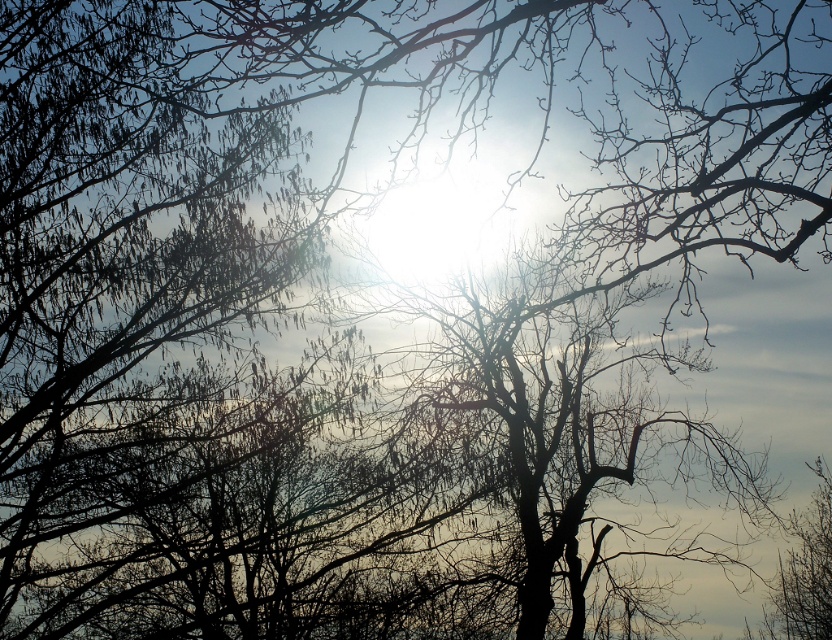
You are an artist sketching the scene and want to ensure the silvery branches at upper left and the black matte tree at center are proportionally accurate. Which object should you draw with finer, more delicate lines to maintain accuracy?

The silvery branches at upper left should be drawn with finer, more delicate lines since they are thinner than the black matte tree at center.

You are an artist sketching the scene and want to ensure proportions are accurate. Which object, the silvery branches at upper left or the black matte tree at center, should you draw taller in your drawing?

The silvery branches at upper left should be drawn taller than the black matte tree at center as per the description provided.

You are an artist planning to paint the scene. You want to ensure the silvery branches at upper left and the black matte tree at center are proportionally accurate. Which object should you paint larger?

The silvery branches at upper left should be painted larger than the black matte tree at center because the silvery branches at upper left is bigger than black matte tree at center according to the description.